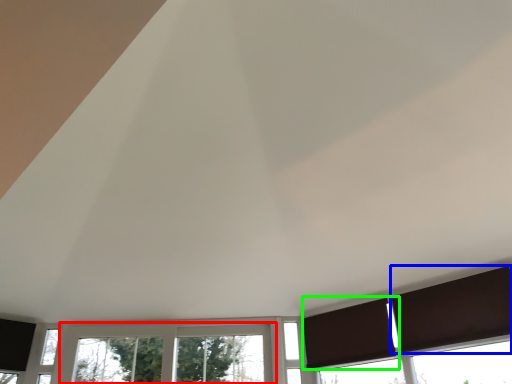
Question: Which object is positioned farthest from window (highlighted by a red box)? Select from curtain (highlighted by a blue box) and curtain (highlighted by a green box).

Choices:
 (A) curtain
 (B) curtain

Answer: (A)